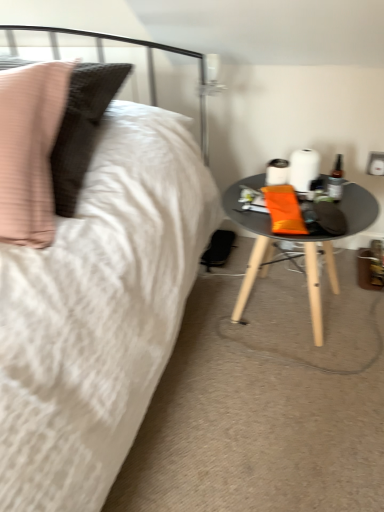
You are a GUI agent. You are given a task and a screenshot of the screen. Output one action in this format:
    pyautogui.click(x=<x>, y=<y>)
    Task: Click on the vacant area in front of translucent glass bottle at right
    
    Given the screenshot: What is the action you would take?
    pyautogui.click(x=351, y=222)